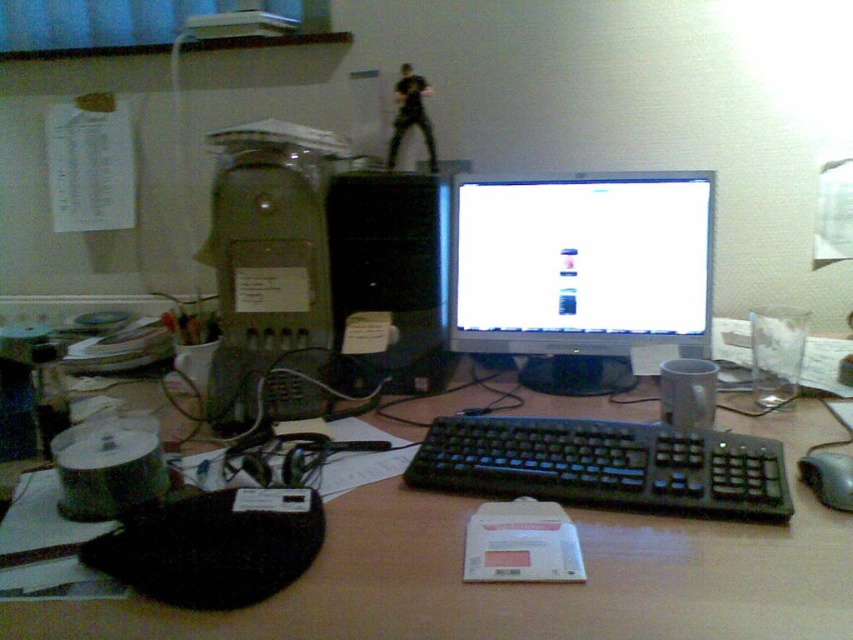
Is matte gray desktop computer at center bigger than black plastic computer tower at center?

Correct, matte gray desktop computer at center is larger in size than black plastic computer tower at center.

Is matte gray desktop computer at center thinner than black plastic computer tower at center?

Incorrect, matte gray desktop computer at center's width is not less than black plastic computer tower at center's.

Which is behind, point (281, 400) or point (340, 227)?

Positioned behind is point (340, 227).

Find the location of a particular element. This screenshot has width=853, height=640. matte gray desktop computer at center is located at coordinates (270, 273).

Between point (572, 228) and point (288, 248), which one is positioned behind?

The point (572, 228) is behind.

Who is positioned more to the left, white glossy monitor at center or matte gray desktop computer at center?

matte gray desktop computer at center

Is point (490, 326) positioned after point (227, 248)?

Yes, point (490, 326) is farther from viewer.

Where is `white glossy monitor at center`? This screenshot has width=853, height=640. white glossy monitor at center is located at coordinates (581, 262).

Between white glossy monitor at center and black plastic computer tower at center, which one has more height?

Standing taller between the two is black plastic computer tower at center.

Looking at this image, who is more distant from viewer, [589,205] or [358,243]?

The point [589,205] is more distant.

Identify the location of white glossy monitor at center. click(581, 262).